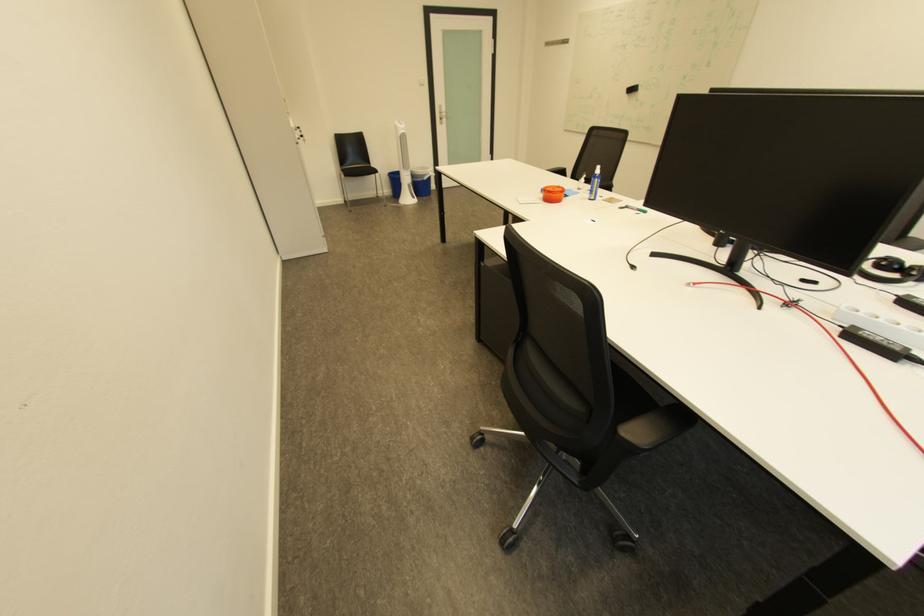
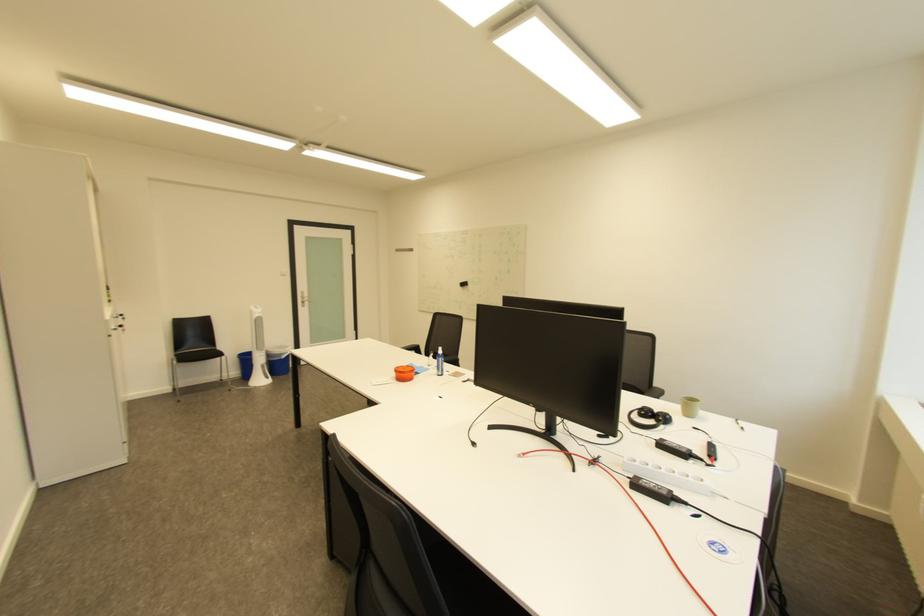
Find the pixel in the second image that matches point 301,130 in the first image.

(116, 322)